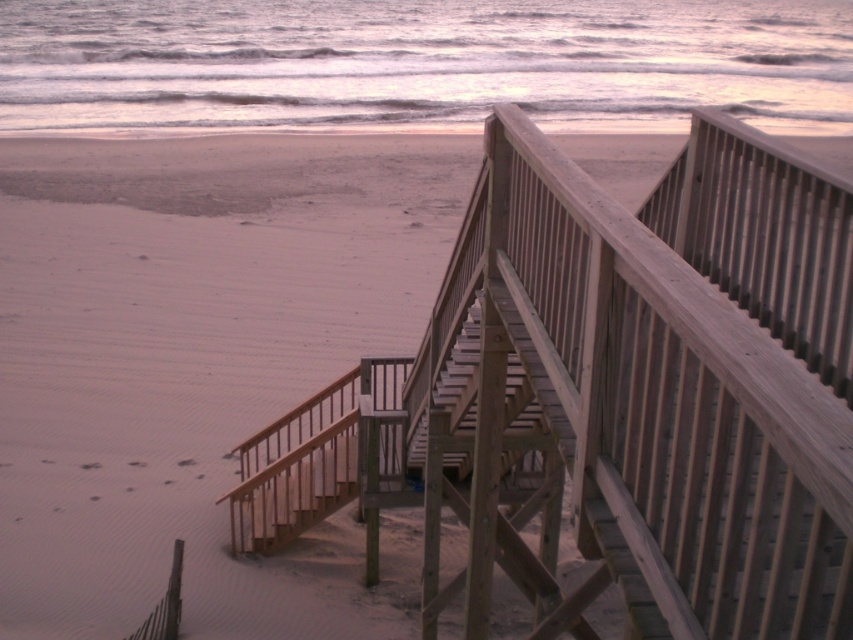
Question: In this image, where is sandy water at upper center located relative to wooden stairs at center?

Choices:
 (A) right
 (B) left

Answer: (A)

Question: Does sandy water at upper center come in front of wooden stairs at center?

Choices:
 (A) yes
 (B) no

Answer: (B)

Question: Which point is closer to the camera taking this photo?

Choices:
 (A) (465, 406)
 (B) (325, 36)

Answer: (A)

Question: Does sandy water at upper center lie behind wooden stairs at center?

Choices:
 (A) no
 (B) yes

Answer: (B)

Question: Which object appears closest to the camera in this image?

Choices:
 (A) sandy water at upper center
 (B) wooden stairs at center

Answer: (B)